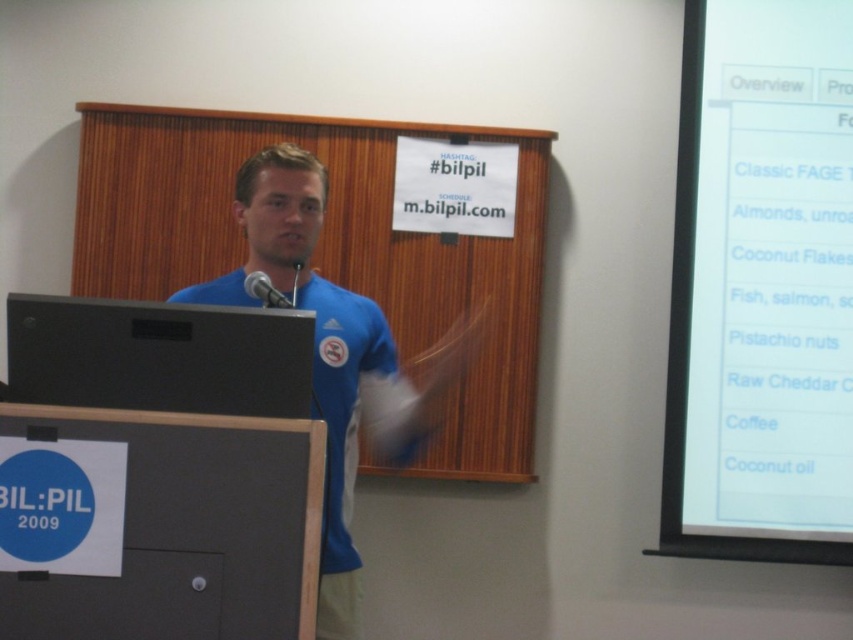
Question: Can you confirm if blue fabric shirt at center is wider than black matte speaker at left?

Choices:
 (A) no
 (B) yes

Answer: (B)

Question: Which point is closer to the camera taking this photo?

Choices:
 (A) (709, 273)
 (B) (305, 355)
 (C) (543, 253)

Answer: (B)

Question: Does wooden at center have a larger size compared to black metallic microphone at center?

Choices:
 (A) yes
 (B) no

Answer: (A)

Question: Observing the image, what is the correct spatial positioning of white paper at upper right in reference to wooden at center?

Choices:
 (A) below
 (B) above

Answer: (A)

Question: Among these objects, which one is nearest to the camera?

Choices:
 (A) blue fabric shirt at center
 (B) white paper at upper right
 (C) black metallic microphone at center
 (D) wooden at center

Answer: (A)

Question: Which point is closer to the camera?

Choices:
 (A) (419, 323)
 (B) (705, 534)

Answer: (B)